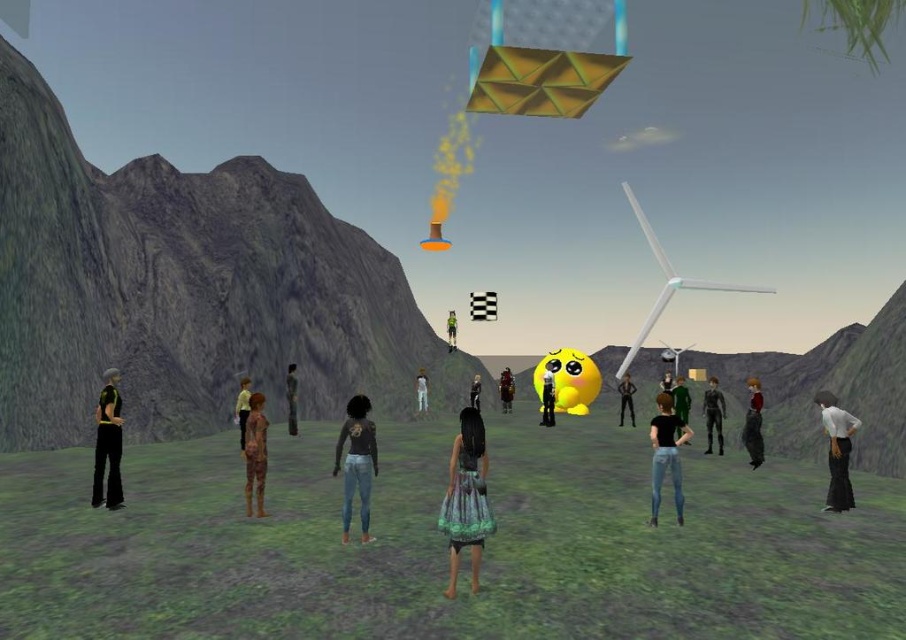
Question: Among these objects, which one is nearest to the camera?

Choices:
 (A) green matte dress at center
 (B) dark gray fabric pants at center
 (C) green fabric shirt at center
 (D) printed fabric dress at center

Answer: (D)

Question: Can you confirm if black matte pants at left is positioned to the left of camouflage-patterned pants at center?

Choices:
 (A) yes
 (B) no

Answer: (A)

Question: Which of the following is the farthest from the observer?

Choices:
 (A) [667, 364]
 (B) [628, 372]
 (C) [255, 458]

Answer: (A)

Question: Which point is closer to the camera?

Choices:
 (A) click(551, 394)
 (B) click(479, 388)
 (C) click(673, 410)
 (D) click(671, 477)

Answer: (D)

Question: Is the position of black matte jeans at center less distant than that of wooden textured figure at center?

Choices:
 (A) no
 (B) yes

Answer: (B)

Question: Where is wooden textured figure at center located in relation to leather jacket at center in the image?

Choices:
 (A) right
 (B) left

Answer: (B)